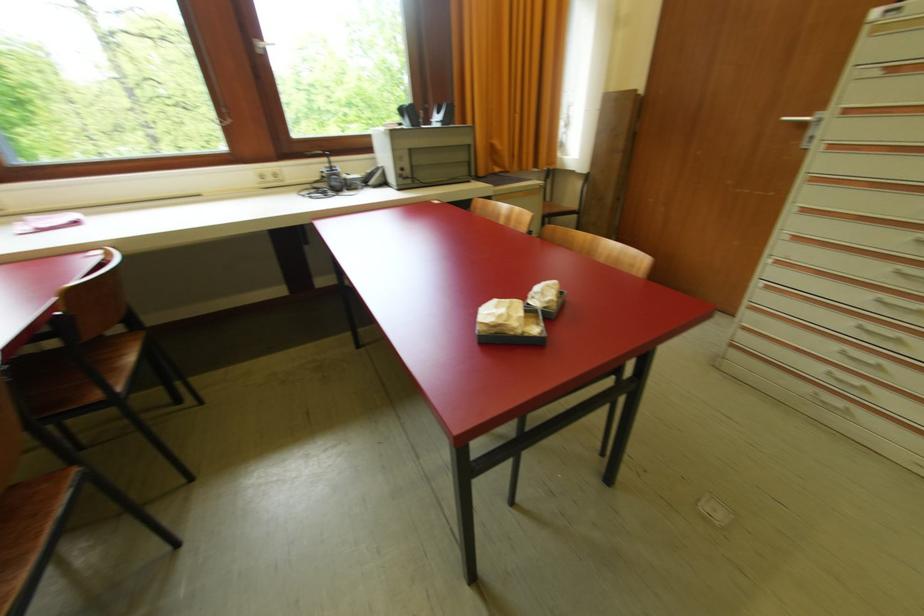
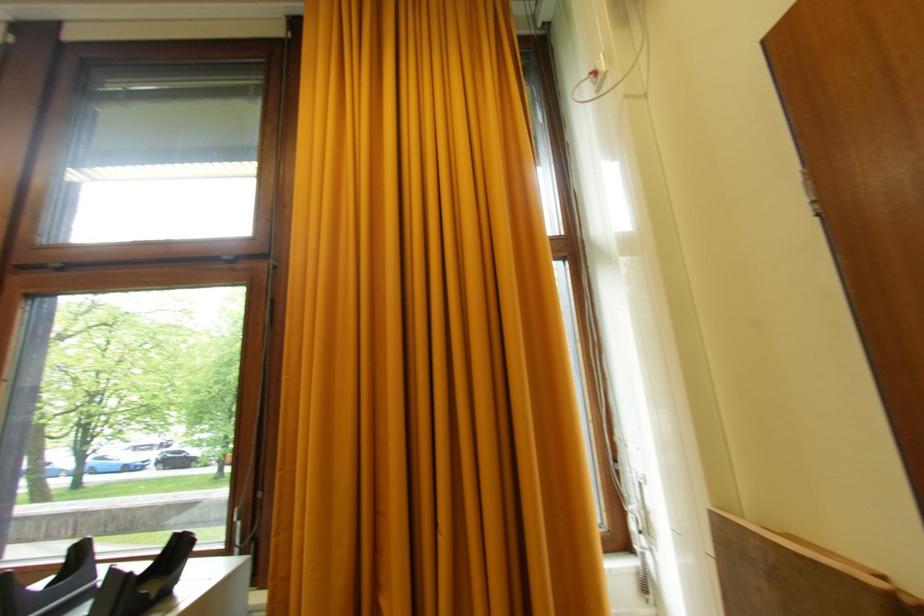
Find the pixel in the second image that matches [517,111] in the first image.

(438, 525)